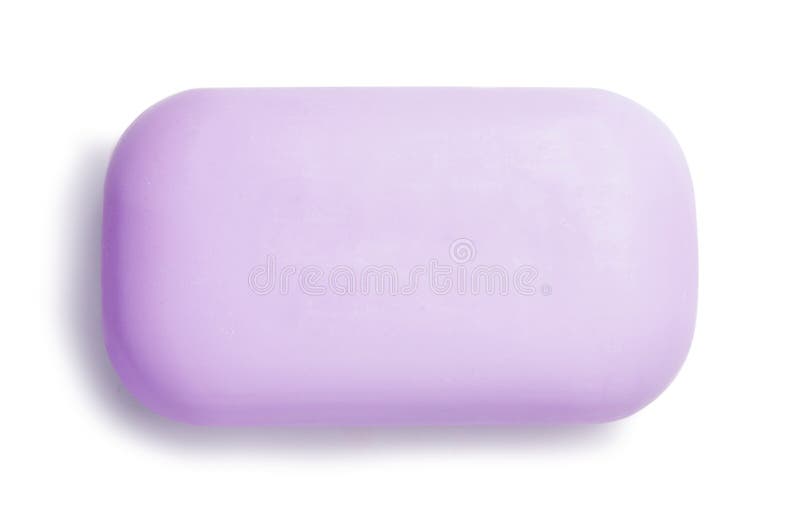
Where is `light`? The image size is (800, 532). light is located at coordinates (612, 191).